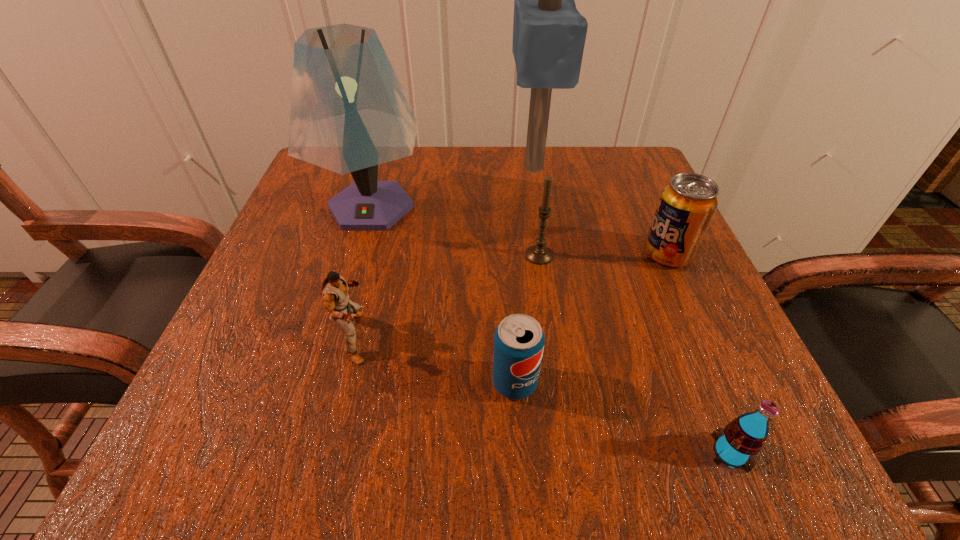
In order to click on free point between the candle and the lampshade in this screenshot , I will do `click(455, 231)`.

This screenshot has height=540, width=960. I want to click on vacant space in between the second farthest soda and the nearest object, so click(x=623, y=417).

This screenshot has height=540, width=960. Identify the location of vacant point located between the second nearest soda and the lampshade. (444, 295).

Find the location of a particular element. This screenshot has height=540, width=960. free space between the leftmost soda and the farthest soda is located at coordinates point(591,319).

At what (x,y) coordinates should I click in order to perform the action: click on vacant area between the farthest soda and the mallet. Please return your answer as a coordinate pair (x, y). Looking at the image, I should click on (601, 211).

Find the location of a particular element. The height and width of the screenshot is (540, 960). free point between the nearest object and the tallest soda is located at coordinates (699, 353).

Identify the location of free spot between the leftmost soda and the nearest soda. This screenshot has height=540, width=960. (623, 417).

Select which object appears as the second closest to the candle. Please provide its 2D coordinates. Your answer should be formatted as a tuple, i.e. [(x, y)], where the tuple contains the x and y coordinates of a point satisfying the conditions above.

[(549, 33)]

Find the location of a particular element. This screenshot has height=540, width=960. object that ranks as the closest to the lampshade is located at coordinates [x=334, y=291].

This screenshot has height=540, width=960. What are the coordinates of `soda that stands as the second closest to the second farthest soda` in the screenshot? It's located at (687, 204).